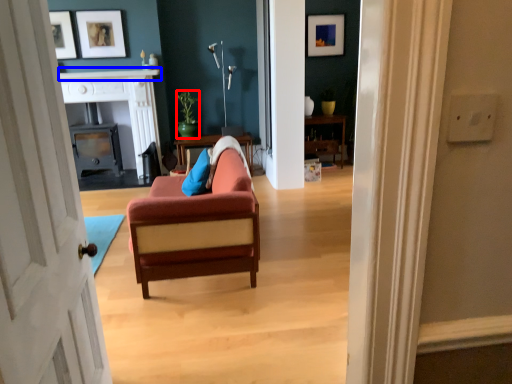
Question: Which object is further to the camera taking this photo, houseplant (highlighted by a red box) or mantle (highlighted by a blue box)?

Choices:
 (A) houseplant
 (B) mantle

Answer: (A)